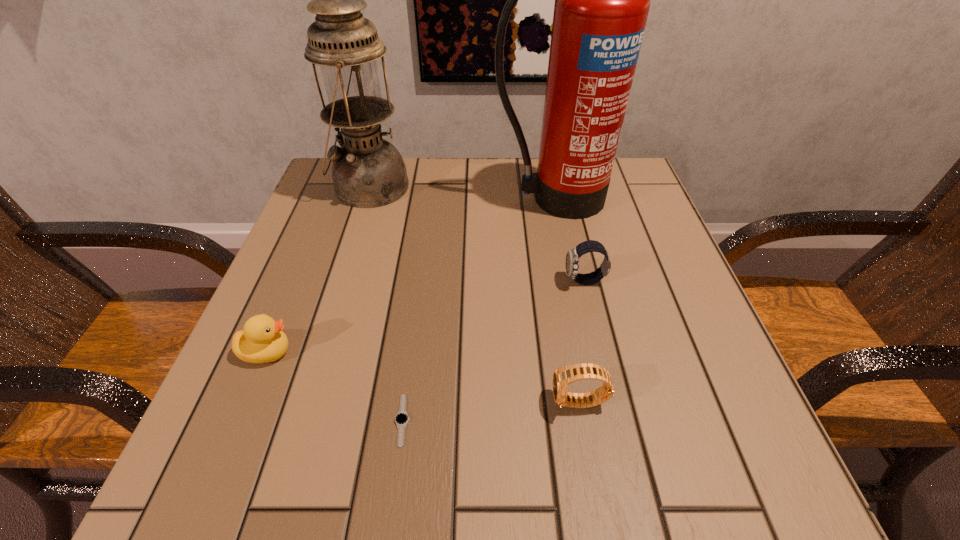
Locate an element on the screen. object present at the far left corner is located at coordinates (368, 172).

You are a GUI agent. You are given a task and a screenshot of the screen. Output one action in this format:
    pyautogui.click(x=<x>, y=<y>)
    Task: Click on the object that is at the far right corner
    Image resolution: width=960 pixels, height=540 pixels.
    Given the screenshot: What is the action you would take?
    (x=602, y=0)

Identify the location of vacant space at the far edge of the desktop. Image resolution: width=960 pixels, height=540 pixels. (479, 183).

Where is `free region at the near edge of the desktop`? The height and width of the screenshot is (540, 960). free region at the near edge of the desktop is located at coordinates pyautogui.click(x=632, y=458).

The image size is (960, 540). Find the location of `free location at the left edge`. free location at the left edge is located at coordinates (298, 342).

Locate an element on the screen. free region at the right edge of the desktop is located at coordinates (640, 384).

Locate an element on the screen. This screenshot has height=540, width=960. vacant area at the far left corner of the desktop is located at coordinates (340, 203).

Find the location of a particular element. This screenshot has width=960, height=540. vacant space at the near left corner of the desktop is located at coordinates (221, 497).

I want to click on vacant region at the far right corner of the desktop, so click(600, 213).

The height and width of the screenshot is (540, 960). Find the location of `free space that is in between the farthest watch and the shortest watch`. free space that is in between the farthest watch and the shortest watch is located at coordinates (493, 350).